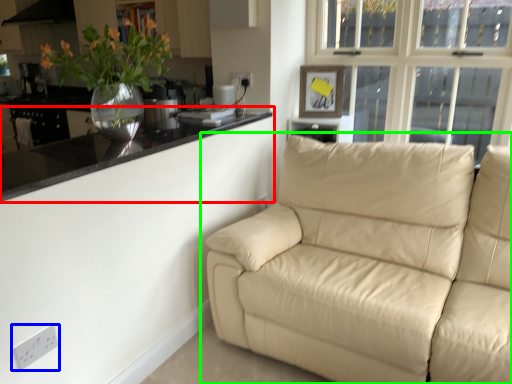
Question: Considering the real-world distances, which object is closest to countertop (highlighted by a red box)? electric outlet (highlighted by a blue box) or studio couch (highlighted by a green box).

Choices:
 (A) electric outlet
 (B) studio couch

Answer: (A)